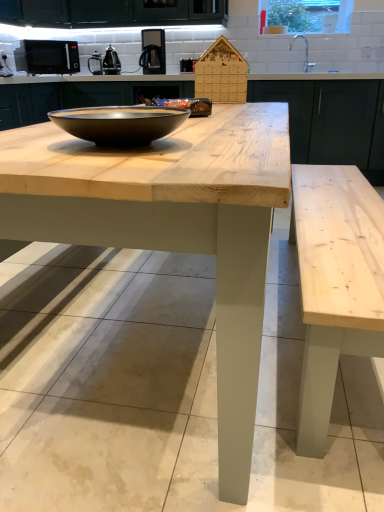
Question: Can black matte microwave at upper left, the second appliance in the right-to-left sequence, be found inside matte black bowl at center?

Choices:
 (A) no
 (B) yes

Answer: (A)

Question: From a real-world perspective, is matte black bowl at center on top of black matte microwave at upper left, placed as the 1th appliance when sorted from left to right?

Choices:
 (A) yes
 (B) no

Answer: (B)

Question: Can you confirm if matte black bowl at center is thinner than black matte microwave at upper left, placed as the 1th appliance when sorted from left to right?

Choices:
 (A) yes
 (B) no

Answer: (A)

Question: Is matte black bowl at center outside of black matte microwave at upper left, placed as the 1th appliance when sorted from left to right?

Choices:
 (A) no
 (B) yes

Answer: (B)

Question: Considering the relative sizes of matte black bowl at center and black matte microwave at upper left, placed as the 1th appliance when sorted from left to right, in the image provided, is matte black bowl at center wider than black matte microwave at upper left, placed as the 1th appliance when sorted from left to right,?

Choices:
 (A) yes
 (B) no

Answer: (B)

Question: Is matte black bowl at center looking in the opposite direction of black matte microwave at upper left, placed as the 1th appliance when sorted from left to right?

Choices:
 (A) no
 (B) yes

Answer: (A)

Question: Does satin black coffee machine at upper center have a larger size compared to matte black bowl at center?

Choices:
 (A) no
 (B) yes

Answer: (B)

Question: Is satin black coffee machine at upper center in front of matte black bowl at center?

Choices:
 (A) no
 (B) yes

Answer: (A)

Question: Can you confirm if satin black coffee machine at upper center is taller than matte black bowl at center?

Choices:
 (A) no
 (B) yes

Answer: (B)

Question: Is satin black coffee machine at upper center beside matte black bowl at center?

Choices:
 (A) no
 (B) yes

Answer: (A)

Question: From the image's perspective, is satin black coffee machine at upper center under matte black bowl at center?

Choices:
 (A) no
 (B) yes

Answer: (A)

Question: Considering the relative positions of satin black coffee machine at upper center and matte black bowl at center in the image provided, is satin black coffee machine at upper center to the right of matte black bowl at center from the viewer's perspective?

Choices:
 (A) yes
 (B) no

Answer: (B)

Question: From a real-world perspective, is black matte microwave at upper left, placed as the 1th appliance when sorted from left to right, positioned under metallic silver kettle at upper center, positioned as the 1th appliance in right-to-left order, based on gravity?

Choices:
 (A) no
 (B) yes

Answer: (A)